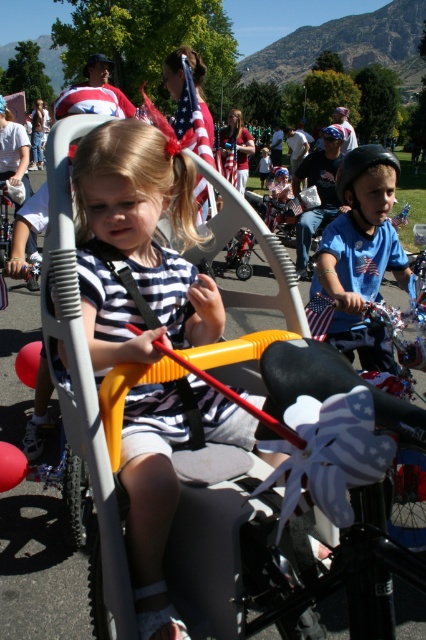
You are a photographer trying to capture both the striped fabric shirt at center and the blue matte shirt at center in a single shot. Which shirt should you focus on first to ensure both are in frame?

The striped fabric shirt at center is positioned under the blue matte shirt at center, so you should focus on the blue matte shirt at center first to ensure both are in frame.

In the scene, there are two children wearing shirts. One is a striped fabric shirt at center and the other is a blue matte shirt at center. Which shirt is positioned to the left?

The striped fabric shirt at center is to the left of the blue matte shirt at center.